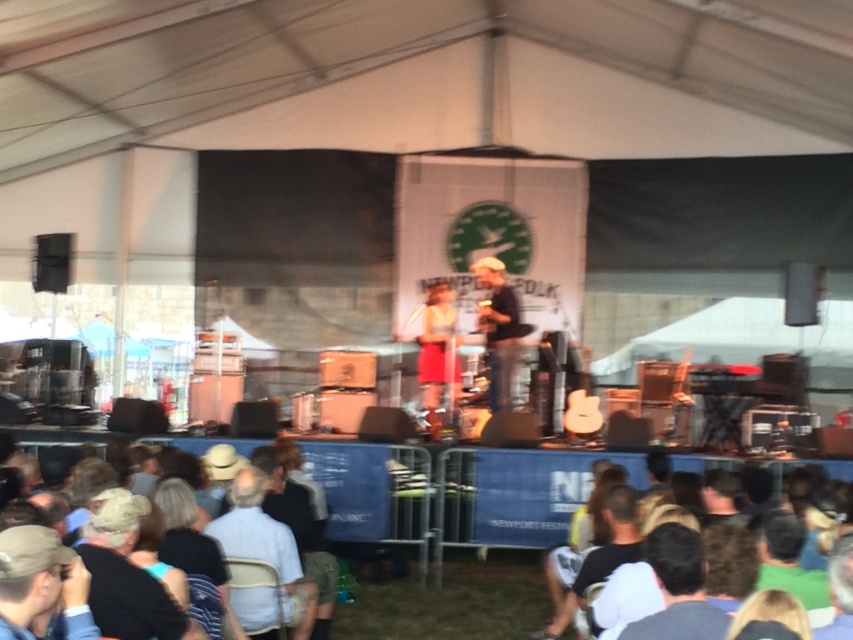
Does point (263, 525) come farther from viewer compared to point (509, 353)?

No.

How far apart are dark blue fabric at lower left and matte brown hat at center?

dark blue fabric at lower left and matte brown hat at center are 4.83 meters apart.

Locate an element on the screen. Image resolution: width=853 pixels, height=640 pixels. dark blue fabric at lower left is located at coordinates (286, 541).

Which is in front, point (312, 636) or point (418, 333)?

Point (312, 636) is more forward.

Describe the element at coordinates (286, 541) in the screenshot. I see `dark blue fabric at lower left` at that location.

Is point (289, 484) farther from viewer compared to point (437, 369)?

No, (289, 484) is closer to viewer.

Locate an element on the screen. dark blue fabric at lower left is located at coordinates (286, 541).

Between brown hair at lower center and yellow fabric shirt at center, which one is positioned higher?

Positioned higher is yellow fabric shirt at center.

Between point (764, 481) and point (426, 353), which one is positioned in front?

Point (764, 481)

The height and width of the screenshot is (640, 853). What are the coordinates of `brown hair at lower center` in the screenshot? It's located at (788, 570).